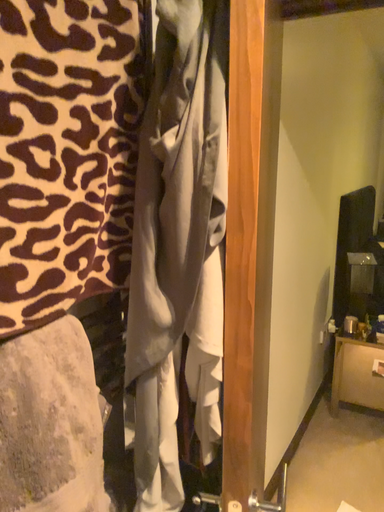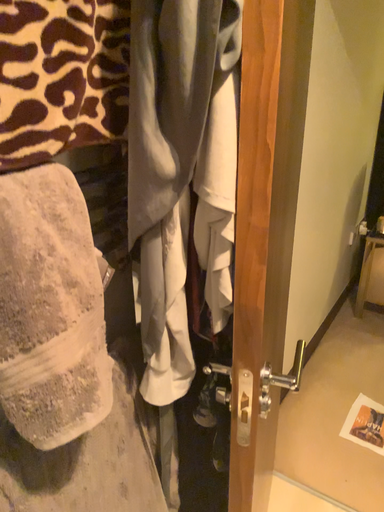
Question: Which way did the camera rotate in the video?

Choices:
 (A) rotated upward
 (B) rotated downward

Answer: (B)